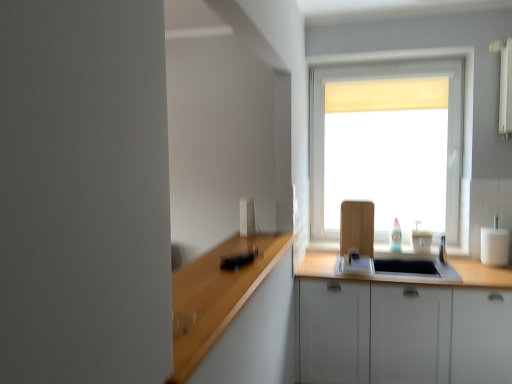
Locate an element on the screen. vacant space to the left of white glossy cup at right, the 2th appliance from the left is located at coordinates (467, 264).